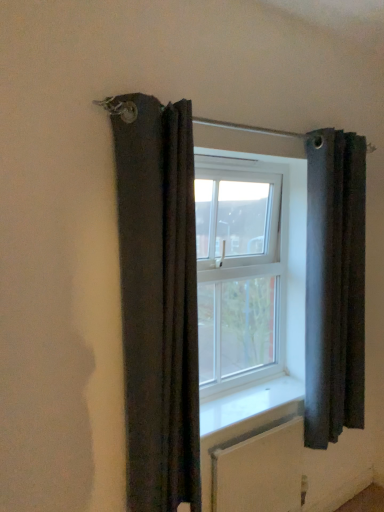
Question: From a real-world perspective, is white textured radiator at lower center positioned above or below dark fabric curtain at left, acting as the first curtain starting from the front?

Choices:
 (A) above
 (B) below

Answer: (B)

Question: Considering their positions, is white textured radiator at lower center located in front of or behind dark fabric curtain at left, which is the 1th curtain in left-to-right order?

Choices:
 (A) front
 (B) behind

Answer: (B)

Question: Which object is the farthest from the dark fabric curtain at left, which is the 1th curtain in left-to-right order?

Choices:
 (A) white smooth window sill at center
 (B) white textured radiator at lower center
 (C) clear glass window at center
 (D) dark gray fabric curtain at right, the 2th curtain in the left-to-right sequence

Answer: (D)

Question: Which is farther from the dark fabric curtain at left, which is the 1th curtain in left-to-right order?

Choices:
 (A) dark gray fabric curtain at right, acting as the 1th curtain starting from the right
 (B) white smooth window sill at center
 (C) white textured radiator at lower center
 (D) clear glass window at center

Answer: (A)